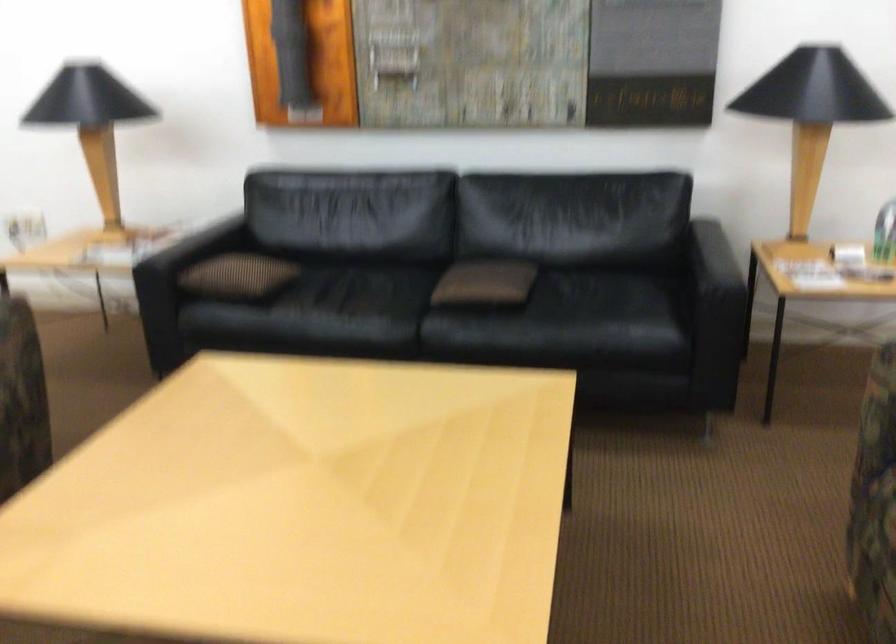
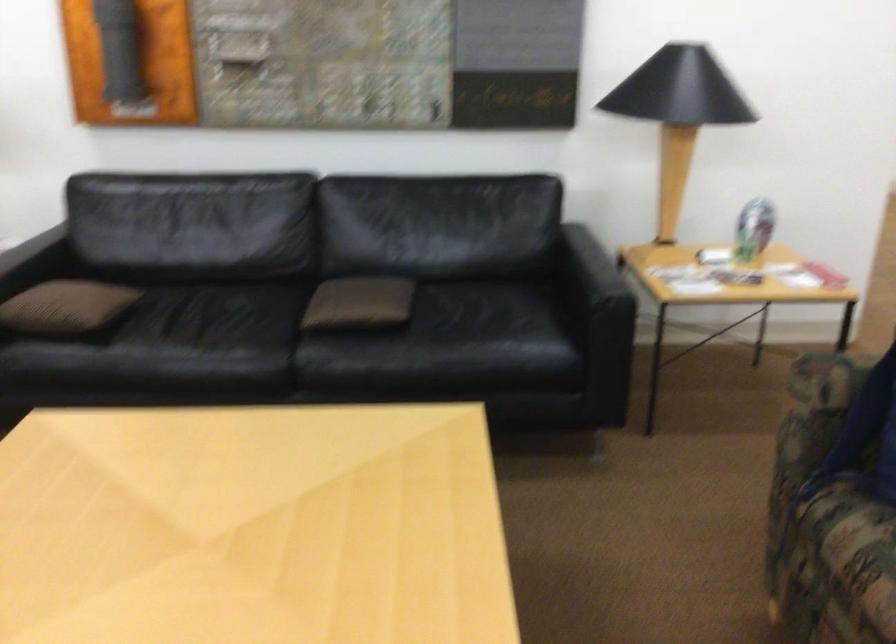
Where in the second image is the point corresponding to point 707,290 from the first image?

(599, 306)